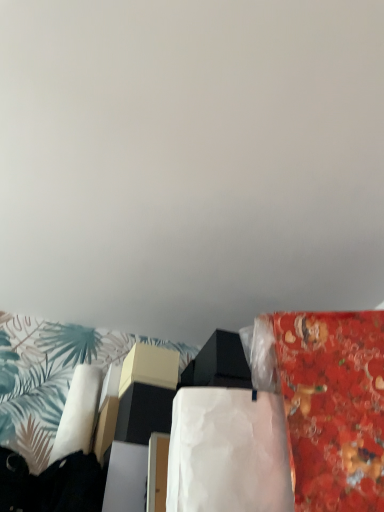
Question: Is white paper at center oriented towards red glossy fabric at right?

Choices:
 (A) no
 (B) yes

Answer: (A)

Question: From a real-world perspective, is white paper at center located higher than red glossy fabric at right?

Choices:
 (A) yes
 (B) no

Answer: (B)

Question: Is white paper at center to the right of red glossy fabric at right from the viewer's perspective?

Choices:
 (A) no
 (B) yes

Answer: (A)

Question: From a real-world perspective, is white paper at center below red glossy fabric at right?

Choices:
 (A) no
 (B) yes

Answer: (B)

Question: Is white paper at center thinner than red glossy fabric at right?

Choices:
 (A) no
 (B) yes

Answer: (A)

Question: Is the surface of white paper at center in direct contact with red glossy fabric at right?

Choices:
 (A) yes
 (B) no

Answer: (B)

Question: Considering the relative sizes of red glossy fabric at right and white paper at center in the image provided, is red glossy fabric at right wider than white paper at center?

Choices:
 (A) yes
 (B) no

Answer: (B)

Question: Considering the relative sizes of red glossy fabric at right and white paper at center in the image provided, is red glossy fabric at right taller than white paper at center?

Choices:
 (A) yes
 (B) no

Answer: (A)

Question: Considering the relative positions of red glossy fabric at right and white paper at center in the image provided, is red glossy fabric at right to the right of white paper at center from the viewer's perspective?

Choices:
 (A) no
 (B) yes

Answer: (B)

Question: Is red glossy fabric at right to the left of white paper at center from the viewer's perspective?

Choices:
 (A) yes
 (B) no

Answer: (B)

Question: Considering the relative sizes of red glossy fabric at right and white paper at center in the image provided, is red glossy fabric at right shorter than white paper at center?

Choices:
 (A) yes
 (B) no

Answer: (B)

Question: Is red glossy fabric at right touching white paper at center?

Choices:
 (A) no
 (B) yes

Answer: (A)

Question: Relative to red glossy fabric at right, is white paper at center in front or behind?

Choices:
 (A) front
 (B) behind

Answer: (B)